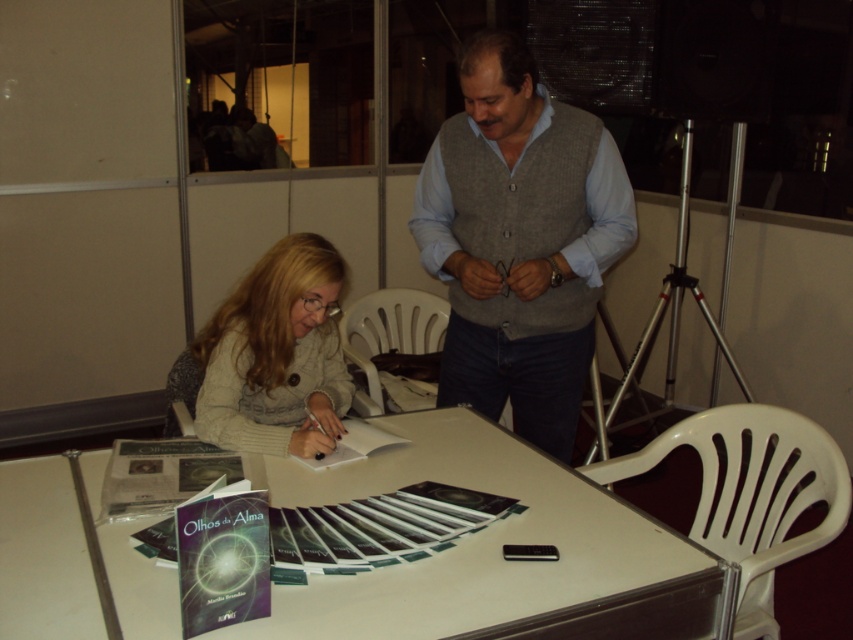
Question: Is white plastic table at center smaller than matte gray sweater at center-left?

Choices:
 (A) no
 (B) yes

Answer: (A)

Question: Considering the real-world distances, which object is closest to the gray knitted vest at center?

Choices:
 (A) white plastic table at center
 (B) matte gray sweater at center-left

Answer: (B)

Question: Based on their relative distances, which object is farther from the white plastic table at center?

Choices:
 (A) gray knitted vest at center
 (B) matte gray sweater at center-left

Answer: (A)

Question: Which object is positioned farthest from the matte gray sweater at center-left?

Choices:
 (A) gray knitted vest at center
 (B) white plastic table at center

Answer: (A)

Question: Can you confirm if white plastic table at center is thinner than gray knitted vest at center?

Choices:
 (A) yes
 (B) no

Answer: (B)

Question: Does white plastic table at center lie behind gray knitted vest at center?

Choices:
 (A) yes
 (B) no

Answer: (B)